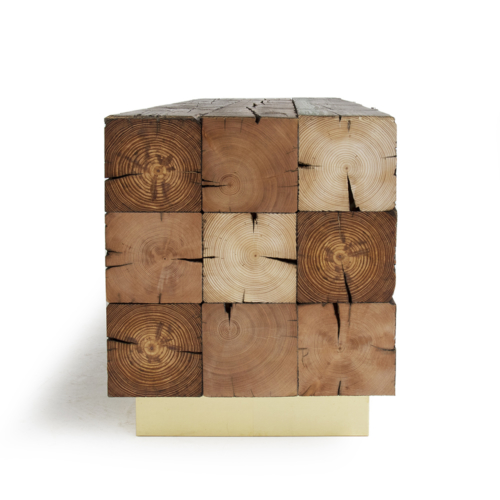
Where is `right bottom board`? This screenshot has height=500, width=500. right bottom board is located at coordinates (344, 336).